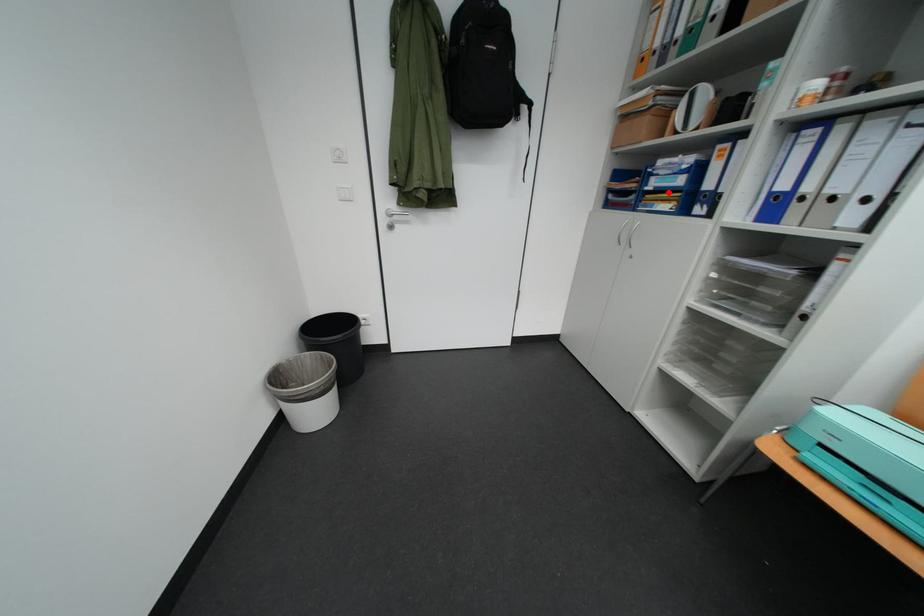
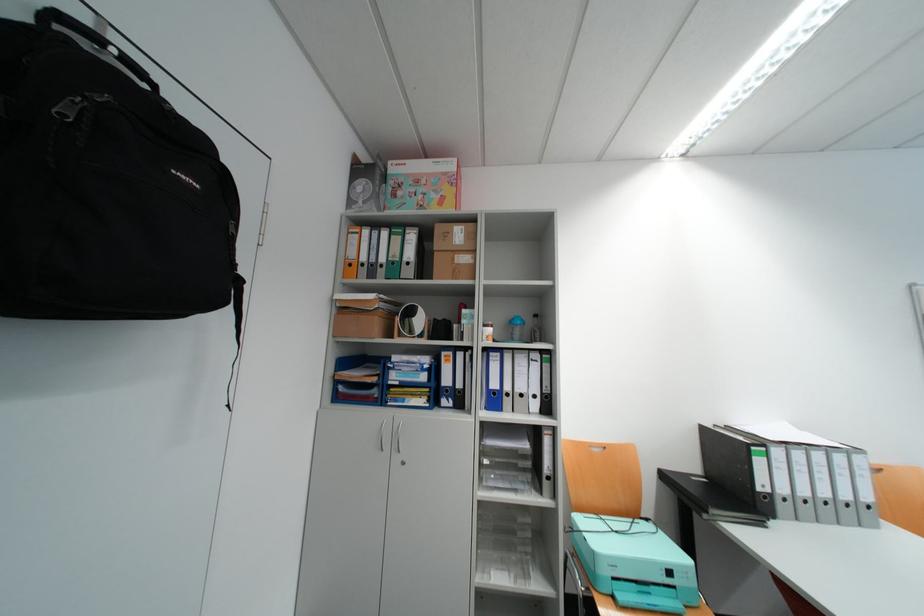
Question: I am providing you with two images of the same scene from different viewpoints. A red point is shown in image1. For the corresponding object point in image2, is it positioned nearer or farther from the camera?

Choices:
 (A) Nearer
 (B) Farther

Answer: (B)